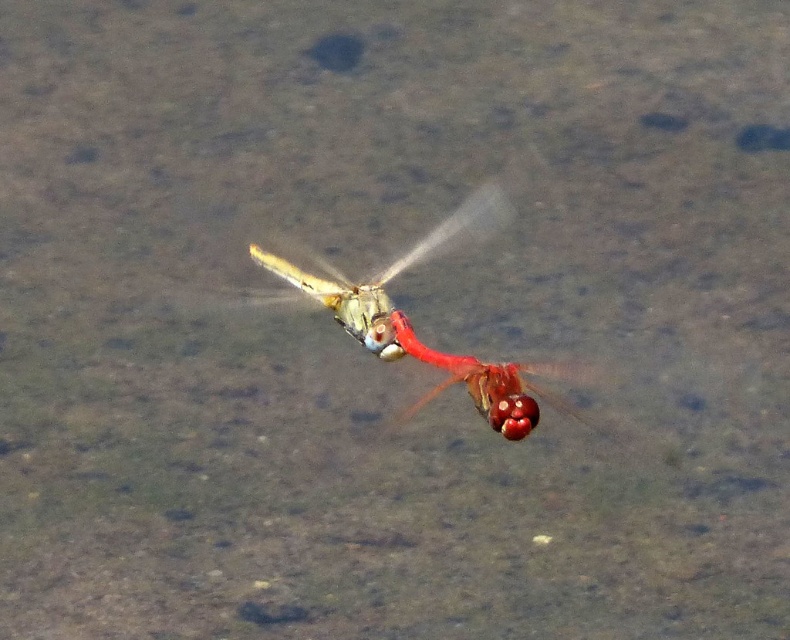
Question: Among these objects, which one is nearest to the camera?

Choices:
 (A) glossy red dragonfly at center
 (B) translucent glass dragonfly at center
 (C) translucent yellow-green dragonfly at center

Answer: (A)

Question: Is translucent yellow-green dragonfly at center in front of glossy red dragonfly at center?

Choices:
 (A) no
 (B) yes

Answer: (A)

Question: Which object is farther from the camera taking this photo?

Choices:
 (A) glossy red dragonfly at center
 (B) translucent glass dragonfly at center
 (C) translucent yellow-green dragonfly at center

Answer: (C)

Question: Which point is farther from the camera taking this photo?

Choices:
 (A) (512, 401)
 (B) (407, 336)
 (C) (340, 285)

Answer: (C)

Question: Can you confirm if translucent glass dragonfly at center is bigger than translucent yellow-green dragonfly at center?

Choices:
 (A) yes
 (B) no

Answer: (A)

Question: Is the position of translucent glass dragonfly at center less distant than that of glossy red dragonfly at center?

Choices:
 (A) no
 (B) yes

Answer: (A)